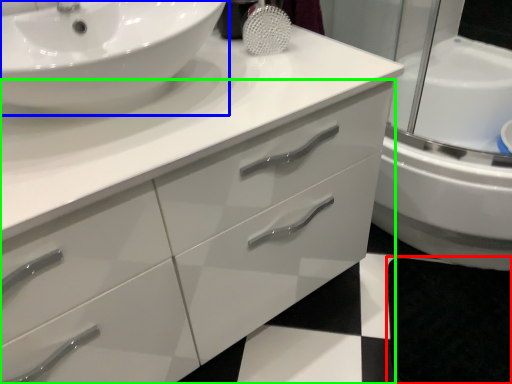
Question: Estimate the real-world distances between objects in this image. Which object is farther from bath mat (highlighted by a red box), sink (highlighted by a blue box) or bathroom cabinet (highlighted by a green box)?

Choices:
 (A) sink
 (B) bathroom cabinet

Answer: (A)